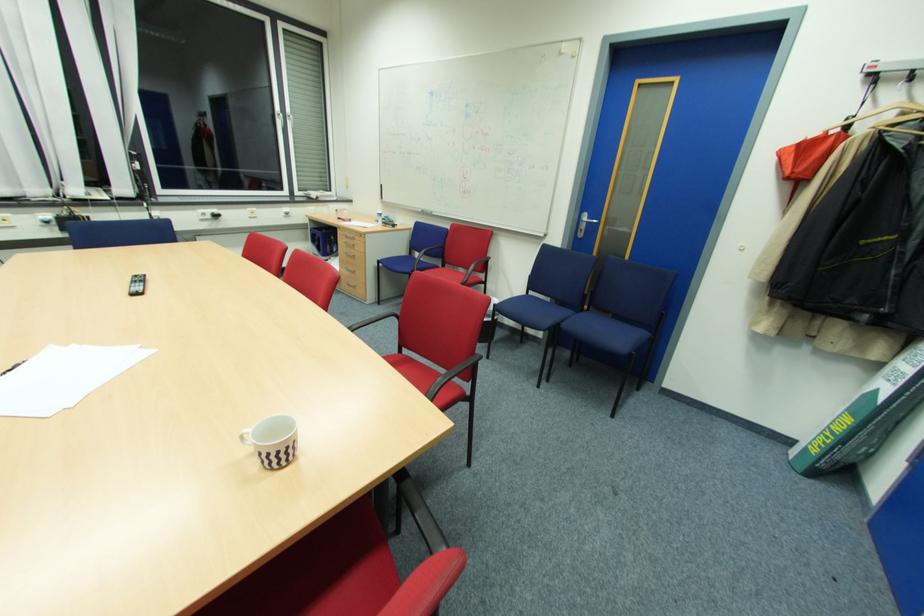
Image resolution: width=924 pixels, height=616 pixels. What do you see at coordinates (588, 219) in the screenshot?
I see `a silver door handle` at bounding box center [588, 219].